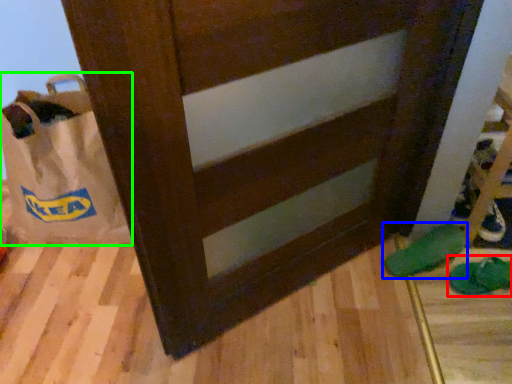
Question: Based on their relative distances, which object is nearer to footwear (highlighted by a red box)? Choose from footwear (highlighted by a blue box) and grocery bag (highlighted by a green box).

Choices:
 (A) footwear
 (B) grocery bag

Answer: (A)